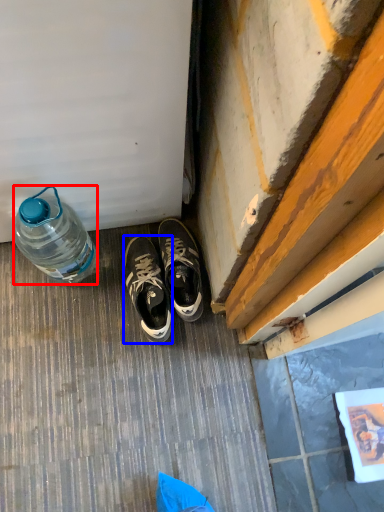
Question: Among these objects, which one is farthest to the camera, bottle (highlighted by a red box) or sneakers (highlighted by a blue box)?

Choices:
 (A) bottle
 (B) sneakers

Answer: (B)